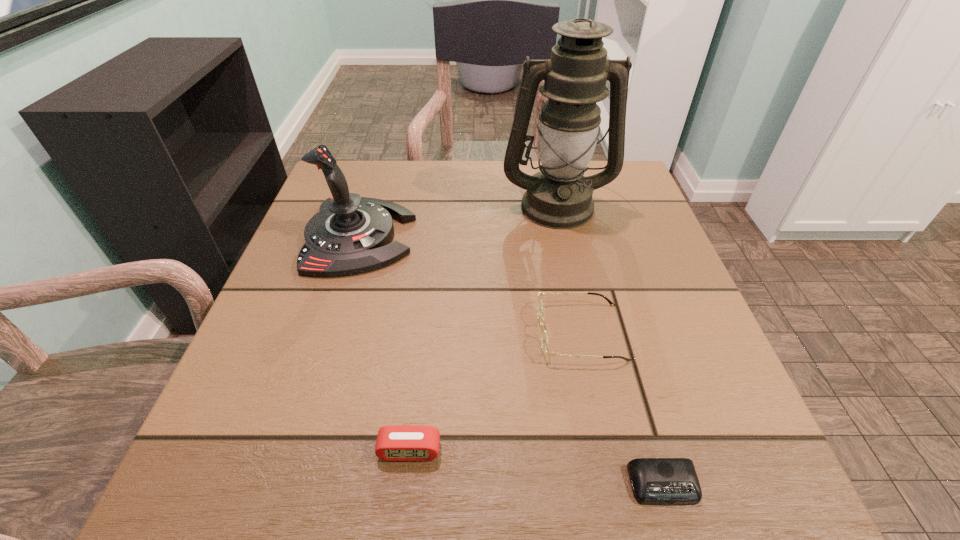
The image size is (960, 540). I want to click on free space between the right alarm clock and the farther alarm clock, so click(x=537, y=468).

At what (x,y) coordinates should I click in order to perform the action: click on free spot between the oil lamp and the spectacles. Please return your answer as a coordinate pair (x, y). This screenshot has width=960, height=540. Looking at the image, I should click on (568, 268).

In order to click on free point between the oil lamp and the joystick in this screenshot , I will do `click(458, 221)`.

You are a GUI agent. You are given a task and a screenshot of the screen. Output one action in this format:
    pyautogui.click(x=<x>, y=<y>)
    Task: Click on the vacant space that's between the nearer alarm clock and the farther alarm clock
    The image size is (960, 540).
    Given the screenshot: What is the action you would take?
    point(537,468)

Locate an element on the screen. The image size is (960, 540). empty location between the tallest object and the joystick is located at coordinates (458, 221).

Identify the location of empty space that is in between the oil lamp and the taller alarm clock. This screenshot has height=540, width=960. (483, 328).

This screenshot has width=960, height=540. In order to click on free point between the oil lamp and the nearest object in this screenshot , I will do `click(610, 345)`.

Identify the location of free spot between the second nearest object and the fourth shortest object. (385, 343).

This screenshot has width=960, height=540. Find the location of `object that is the fourth closest to the leftmost object`. object that is the fourth closest to the leftmost object is located at coordinates (657, 481).

Locate which object ranks second in proximity to the oil lamp. Please provide its 2D coordinates. Your answer should be formatted as a tuple, i.e. [(x, y)], where the tuple contains the x and y coordinates of a point satisfying the conditions above.

[(544, 340)]